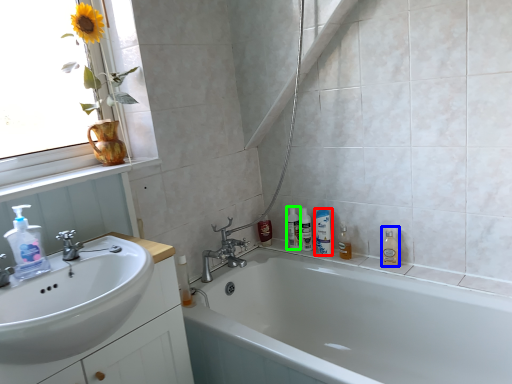
Question: Which object is positioned closest to mouthwash (highlighted by a red box)? Select from cleaning product (highlighted by a blue box) and toiletry (highlighted by a green box).

Choices:
 (A) cleaning product
 (B) toiletry

Answer: (B)